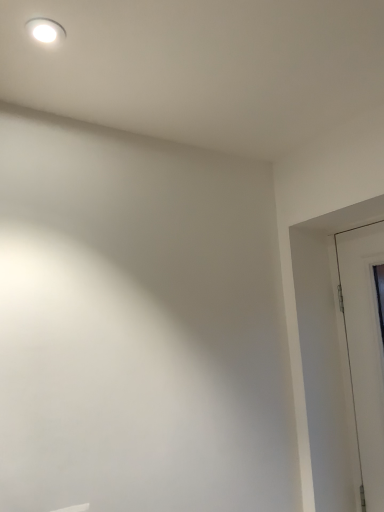
What do you see at coordinates (46, 30) in the screenshot? I see `white glossy light fixture at upper left` at bounding box center [46, 30].

Find the location of a particular element. This screenshot has height=512, width=384. white glossy light fixture at upper left is located at coordinates tap(46, 30).

In order to face white glossy light fixture at upper left, should I rotate leftwards or rightwards?

To face it directly, rotate left by 19.087 degrees.

This screenshot has height=512, width=384. Identify the location of white glossy door at right. (365, 349).

This screenshot has width=384, height=512. Describe the element at coordinates (365, 349) in the screenshot. I see `white glossy door at right` at that location.

What is the approximate width of white glossy door at right?

white glossy door at right is 0.85 inches in width.

Where is `white glossy light fixture at upper left`? Image resolution: width=384 pixels, height=512 pixels. white glossy light fixture at upper left is located at coordinates (46, 30).

Does white glossy light fixture at upper left appear on the left side of white glossy door at right?

Yes.

Is white glossy light fixture at upper left positioned before white glossy door at right?

Yes, the depth of white glossy light fixture at upper left is less than that of white glossy door at right.

Which is nearer, [32,20] or [342,289]?

Point [32,20] is closer to the camera than point [342,289].

From the image's perspective, which is below, white glossy light fixture at upper left or white glossy door at right?

white glossy door at right, from the image's perspective.

Based on the photo, from a real-world perspective, is white glossy light fixture at upper left physically located above or below white glossy door at right?

Clearly, from a real-world perspective, white glossy light fixture at upper left is above white glossy door at right.

Which object is wider, white glossy light fixture at upper left or white glossy door at right?

white glossy light fixture at upper left.

Between white glossy light fixture at upper left and white glossy door at right, which one has less height?

white glossy light fixture at upper left is shorter.

Who is smaller, white glossy light fixture at upper left or white glossy door at right?

white glossy light fixture at upper left.

Is white glossy door at right inside white glossy light fixture at upper left?

Actually, white glossy door at right is outside white glossy light fixture at upper left.

Are white glossy light fixture at upper left and white glossy door at right making contact?

There is a gap between white glossy light fixture at upper left and white glossy door at right.

Does white glossy light fixture at upper left turn towards white glossy door at right?

No, white glossy light fixture at upper left does not turn towards white glossy door at right.

How many degrees apart are the facing directions of white glossy light fixture at upper left and white glossy door at right?

0.194 degrees.

Looking at this image, how much distance is there between white glossy light fixture at upper left and white glossy door at right?

white glossy light fixture at upper left and white glossy door at right are 1.42 meters apart.

Identify the location of lighting above the white glossy door at right (from the image's perspective). The height and width of the screenshot is (512, 384). pos(46,30).

Based on their positions, is white glossy door at right located to the left or right of white glossy light fixture at upper left?

In the image, white glossy door at right appears on the right side of white glossy light fixture at upper left.

Which is behind, white glossy door at right or white glossy light fixture at upper left?

white glossy door at right is further away from the camera.

Which is further, [345,325] or [40,37]?

The point [345,325] is more distant.

From the image's perspective, is white glossy door at right below white glossy light fixture at upper left?

Yes, from the image's perspective, white glossy door at right is below white glossy light fixture at upper left.

From a real-world perspective, is white glossy door at right over white glossy light fixture at upper left?

Actually, white glossy door at right is physically below white glossy light fixture at upper left in the real world.

In terms of width, does white glossy door at right look wider or thinner when compared to white glossy light fixture at upper left?

white glossy door at right is thinner than white glossy light fixture at upper left.

Considering the relative sizes of white glossy door at right and white glossy light fixture at upper left in the image provided, is white glossy door at right taller than white glossy light fixture at upper left?

Indeed, white glossy door at right has a greater height compared to white glossy light fixture at upper left.

Does white glossy door at right have a larger size compared to white glossy light fixture at upper left?

Yes, white glossy door at right is bigger than white glossy light fixture at upper left.

Would you say white glossy door at right is inside or outside white glossy light fixture at upper left?

white glossy door at right is located beyond the bounds of white glossy light fixture at upper left.

Is white glossy door at right far away from white glossy light fixture at upper left?

Yes, white glossy door at right is far from white glossy light fixture at upper left.

Is white glossy door at right facing away from white glossy light fixture at upper left?

No, white glossy door at right's orientation is not away from white glossy light fixture at upper left.

What's the angular difference between white glossy door at right and white glossy light fixture at upper left's facing directions?

The facing directions of white glossy door at right and white glossy light fixture at upper left are 0.194 degrees apart.

Find the location of a particular element. The image size is (384, 512). door on the right of white glossy light fixture at upper left is located at coordinates (365, 349).

In order to click on lighting above the white glossy door at right (from the image's perspective) in this screenshot , I will do `click(46, 30)`.

Identify the location of lighting located in front of the white glossy door at right. (46, 30).